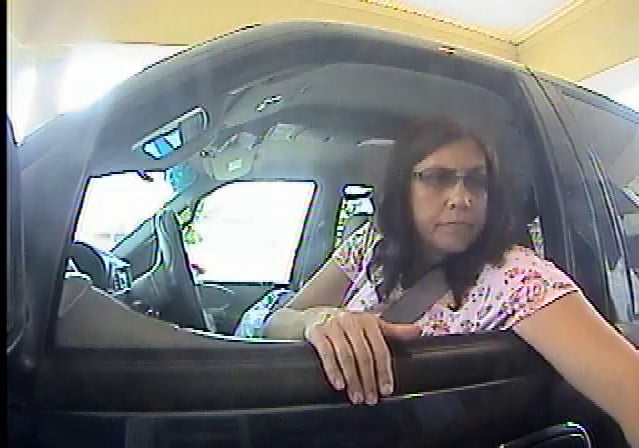
The height and width of the screenshot is (448, 639). What are the coordinates of `ceiling` in the screenshot? It's located at (589, 36).